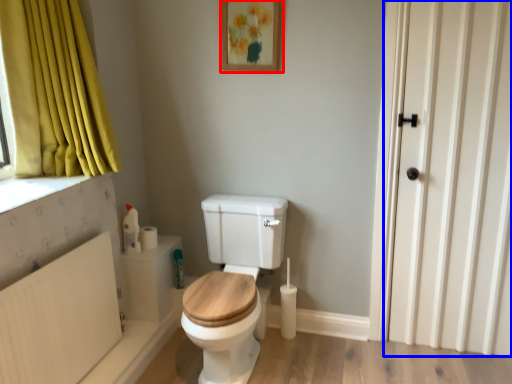
Question: Which point is further to the camera, picture frame (highlighted by a red box) or door (highlighted by a blue box)?

Choices:
 (A) picture frame
 (B) door

Answer: (A)